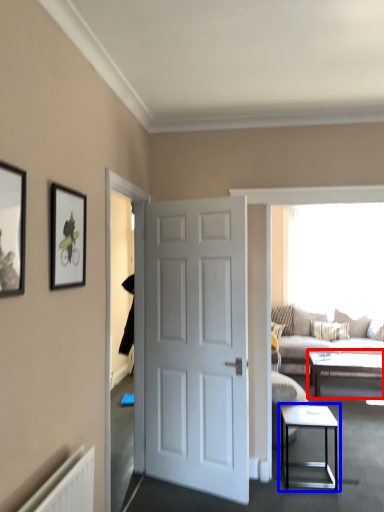
Question: Which object appears closest to the camera in this image, coffee table (highlighted by a red box) or table (highlighted by a blue box)?

Choices:
 (A) coffee table
 (B) table

Answer: (B)